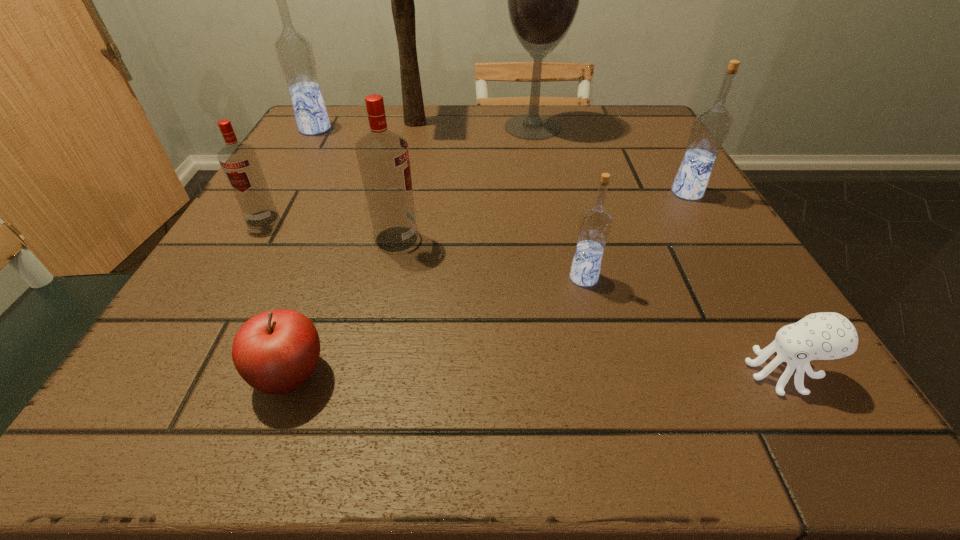
Locate an element on the screen. The width and height of the screenshot is (960, 540). vodka that is the fifth closest to the mallet is located at coordinates (711, 126).

Identify the location of the closest vodka relative to the leftmost blue vodka. This screenshot has width=960, height=540. (239, 161).

You are a GUI agent. You are given a task and a screenshot of the screen. Output one action in this format:
    pyautogui.click(x=<x>, y=<y>)
    Task: Click on the blue vodka that can be found as the second closest to the farthest blue vodka
    
    Given the screenshot: What is the action you would take?
    pyautogui.click(x=711, y=126)

This screenshot has height=540, width=960. What are the coordinates of `blue vodka that can be found as the second closest to the apple` in the screenshot? It's located at (294, 51).

This screenshot has width=960, height=540. I want to click on vacant space that satisfies the following two spatial constraints: 1. on the front side of the mallet; 2. on the left side of the nearest blue vodka, so click(x=377, y=278).

This screenshot has width=960, height=540. Identify the location of free spot that satisfies the following two spatial constraints: 1. on the front label of the red apple; 2. on the right side of the smaller red vodka. (171, 375).

Find the location of `free spot that satisfies the following two spatial constraints: 1. on the front-facing side of the octopus; 2. on the front side of the third object from left to right`. free spot that satisfies the following two spatial constraints: 1. on the front-facing side of the octopus; 2. on the front side of the third object from left to right is located at coordinates (784, 375).